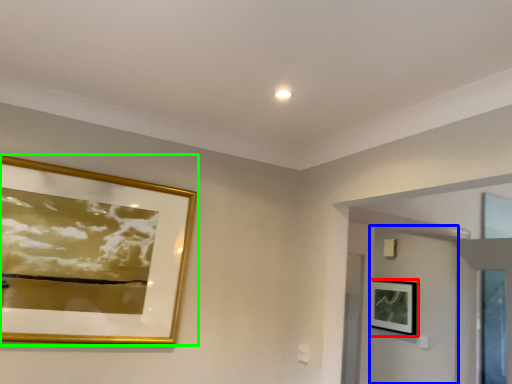
Question: Estimate the real-world distances between objects in this image. Which object is farther from picture frame (highlighted by a red box), door (highlighted by a blue box) or picture frame (highlighted by a green box)?

Choices:
 (A) door
 (B) picture frame

Answer: (B)